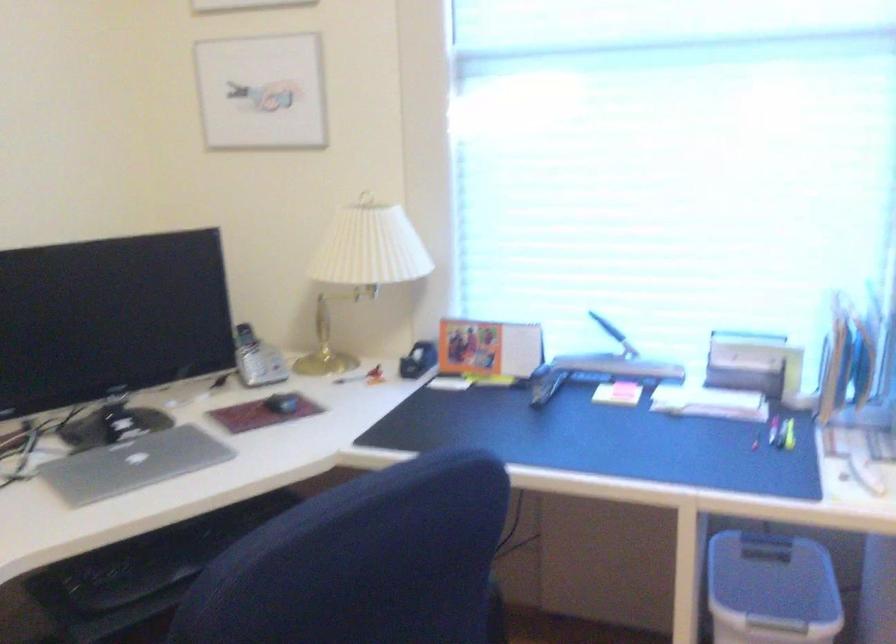
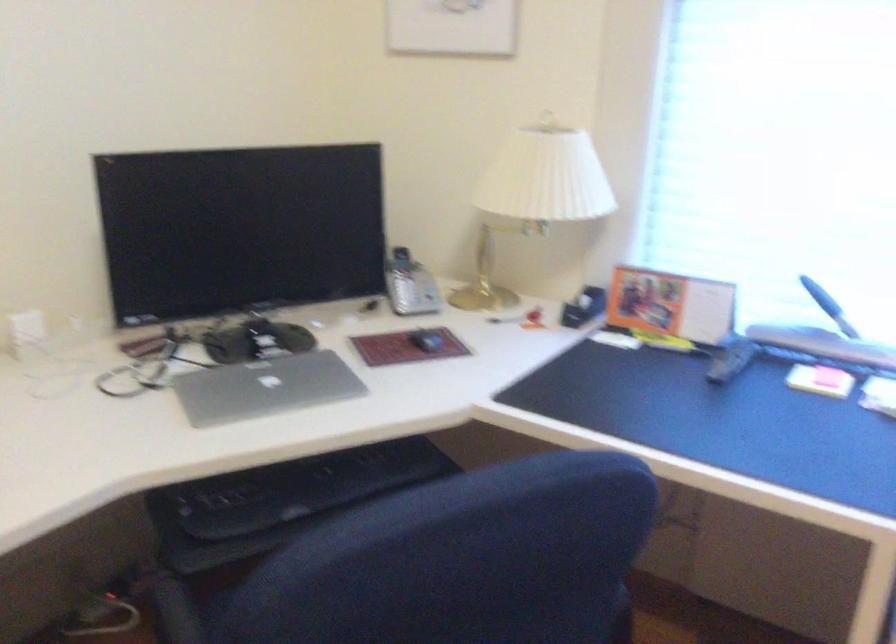
Find the pixel in the second image that matches (x=247, y=354) in the first image.

(401, 281)